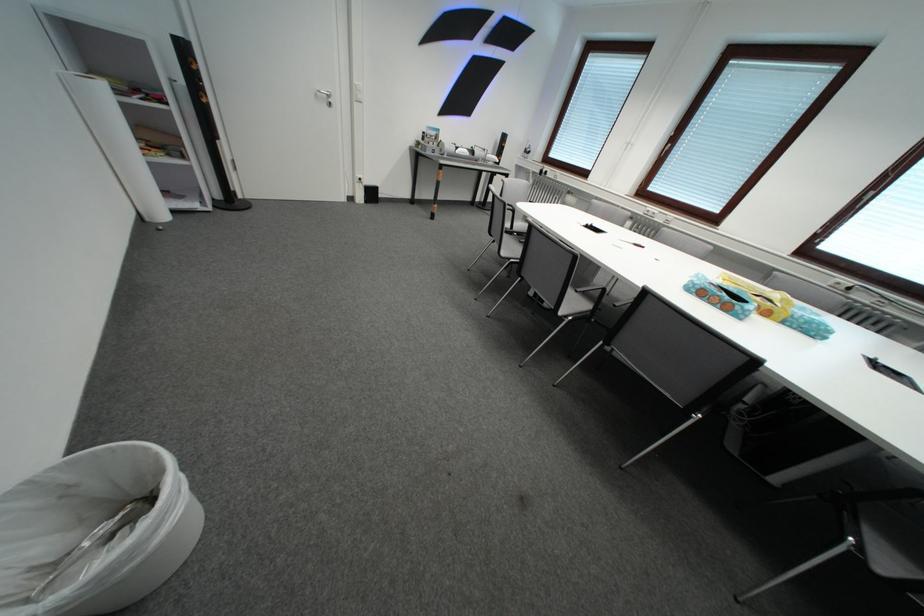
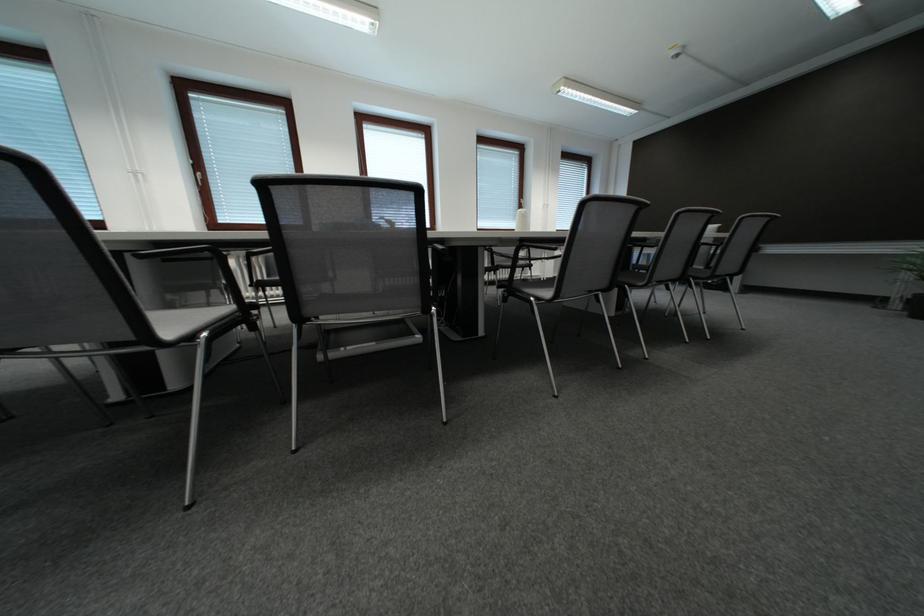
Question: The first image is from the beginning of the video and the second image is from the end. How did the camera likely rotate when shooting the video?

Choices:
 (A) Left
 (B) Right
 (C) Up
 (D) Down

Answer: (B)